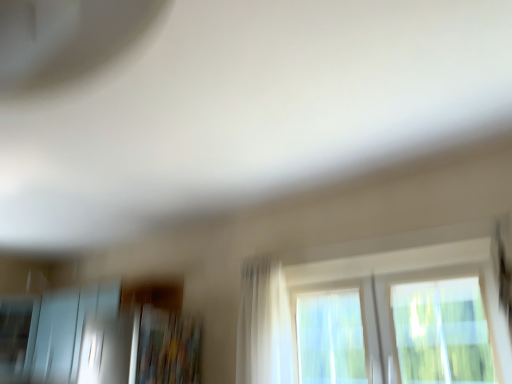
Question: Is frosted glass screen door at lower left inside or outside of transparent glass window at center?

Choices:
 (A) inside
 (B) outside

Answer: (B)

Question: From the image's perspective, is frosted glass screen door at lower left positioned above or below transparent glass window at center?

Choices:
 (A) below
 (B) above

Answer: (A)

Question: Which of these objects is positioned closest to the white sheer curtain at center?

Choices:
 (A) frosted glass screen door at lower left
 (B) transparent glass window at center

Answer: (B)

Question: Estimate the real-world distances between objects in this image. Which object is closer to the transparent glass window at center?

Choices:
 (A) frosted glass screen door at lower left
 (B) white sheer curtain at center

Answer: (B)